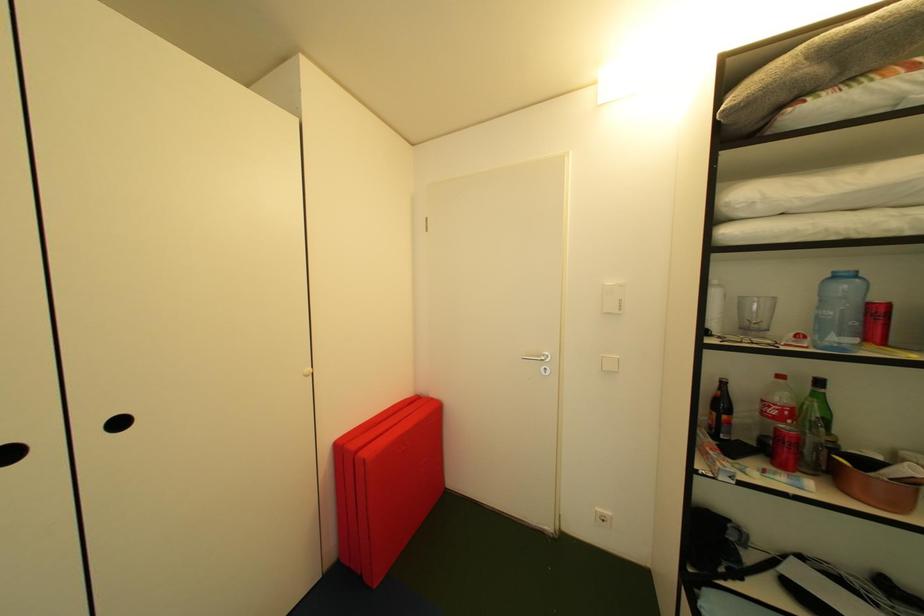
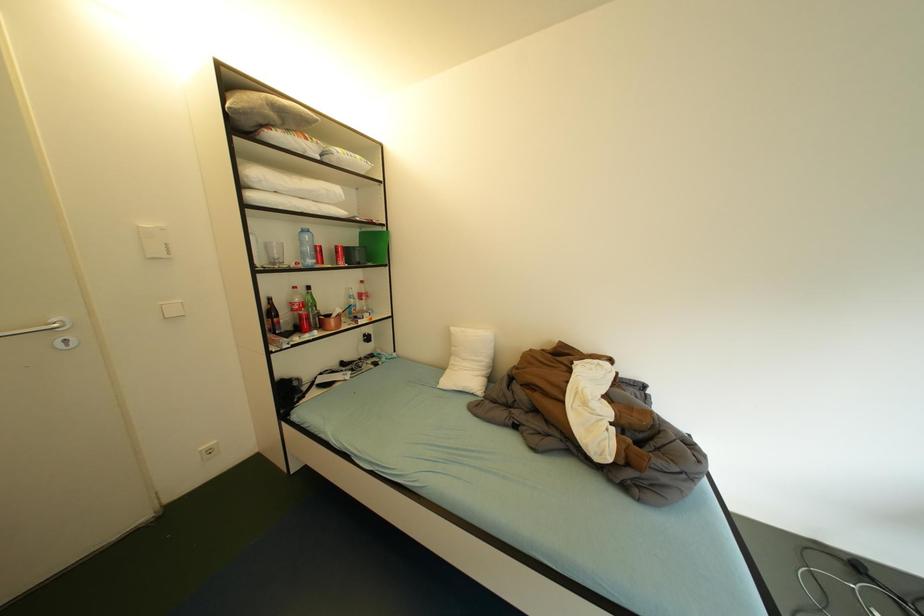
Question: Based on the continuous images, in which direction is the camera rotating? Reply with the corresponding letter.

Choices:
 (A) Left
 (B) Right
 (C) Up
 (D) Down

Answer: (B)